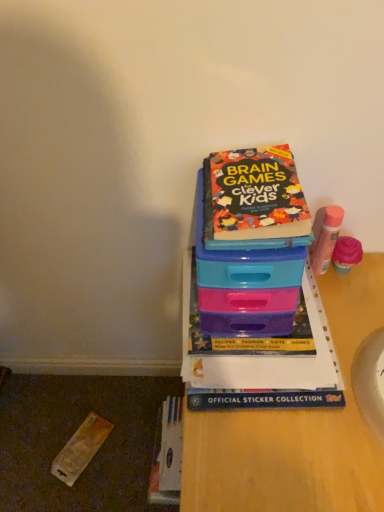
Question: In which direction should I rotate to look at hardcover book at center, arranged as the 2th book when viewed from the top?

Choices:
 (A) left
 (B) right

Answer: (B)

Question: Is plastic at center completely or partially inside multicolored paper book at upper center, the second book ordered from the bottom?

Choices:
 (A) no
 (B) yes

Answer: (A)

Question: From the image's perspective, is multicolored paper book at upper center, the 1th book when ordered from top to bottom, above plastic at center?

Choices:
 (A) no
 (B) yes

Answer: (B)

Question: Is there a large distance between multicolored paper book at upper center, the 1th book when ordered from top to bottom, and plastic at center?

Choices:
 (A) yes
 (B) no

Answer: (B)

Question: Could you tell me if multicolored paper book at upper center, the 1th book when ordered from top to bottom, is turned towards plastic at center?

Choices:
 (A) yes
 (B) no

Answer: (B)

Question: Is multicolored paper book at upper center, the 1th book when ordered from top to bottom, in front of plastic at center?

Choices:
 (A) yes
 (B) no

Answer: (B)

Question: From a real-world perspective, is multicolored paper book at upper center, the 1th book when ordered from top to bottom, below plastic at center?

Choices:
 (A) yes
 (B) no

Answer: (B)

Question: Considering the relative sizes of plastic at center and hardcover book at center, arranged as the 2th book when viewed from the top, in the image provided, is plastic at center smaller than hardcover book at center, arranged as the 2th book when viewed from the top,?

Choices:
 (A) yes
 (B) no

Answer: (B)

Question: Is plastic at center shorter than hardcover book at center, arranged as the 2th book when viewed from the top?

Choices:
 (A) yes
 (B) no

Answer: (B)

Question: Could you tell me if plastic at center is turned towards hardcover book at center, arranged as the 1th book when ordered from the bottom?

Choices:
 (A) no
 (B) yes

Answer: (A)

Question: From a real-world perspective, is plastic at center located beneath hardcover book at center, arranged as the 2th book when viewed from the top?

Choices:
 (A) yes
 (B) no

Answer: (A)

Question: Is the surface of plastic at center in direct contact with hardcover book at center, arranged as the 2th book when viewed from the top?

Choices:
 (A) no
 (B) yes

Answer: (A)

Question: Does plastic at center have a lesser width compared to hardcover book at center, arranged as the 2th book when viewed from the top?

Choices:
 (A) yes
 (B) no

Answer: (B)

Question: Does multicolored paper book at upper center, the 1th book when ordered from top to bottom, have a lesser height compared to hardcover book at center, arranged as the 1th book when ordered from the bottom?

Choices:
 (A) no
 (B) yes

Answer: (A)